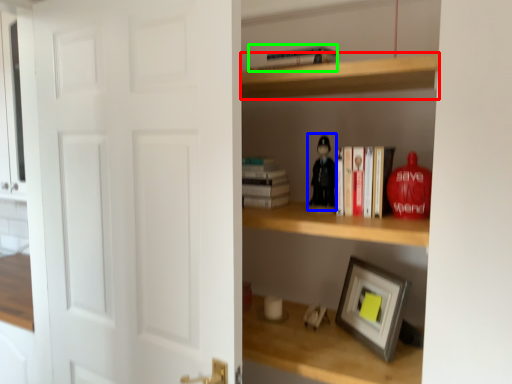
Question: Which object is positioned closest to cabinet (highlighted by a red box)? Select from toy (highlighted by a blue box) and book (highlighted by a green box).

Choices:
 (A) toy
 (B) book

Answer: (B)